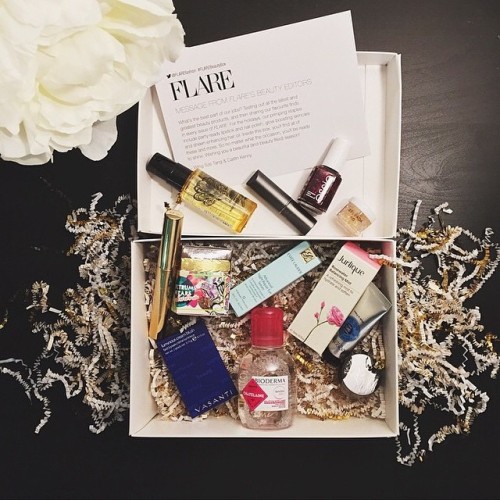
This screenshot has height=500, width=500. In order to click on bottles in this screenshot , I will do `click(220, 195)`, `click(268, 192)`, `click(281, 368)`.